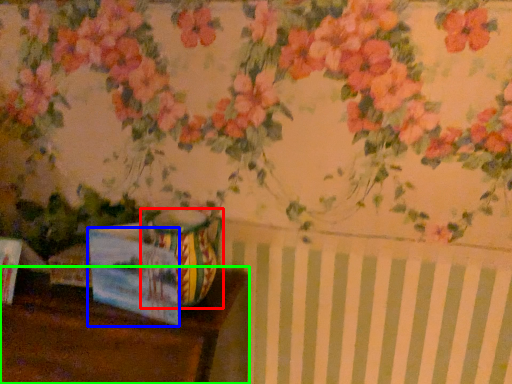
Question: Estimate the real-world distances between objects in this image. Which object is farther from vase (highlighted by a red box), postcard (highlighted by a blue box) or table (highlighted by a green box)?

Choices:
 (A) postcard
 (B) table

Answer: (B)